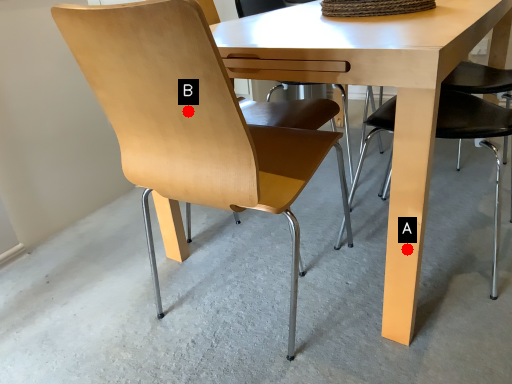
Question: Two points are circled on the image, labeled by A and B beside each circle. Which of the following is the closest to the observer?

Choices:
 (A) A is closer
 (B) B is closer

Answer: (B)